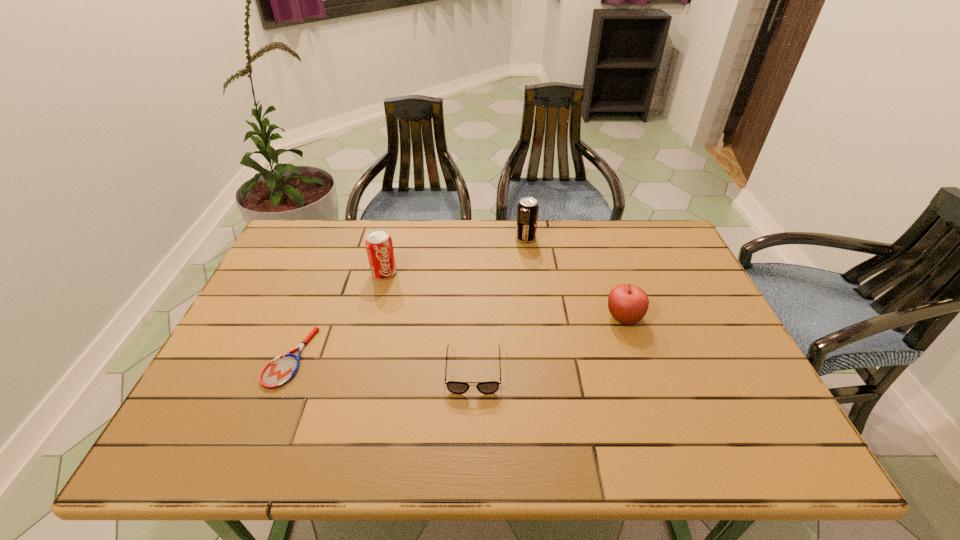
Image resolution: width=960 pixels, height=540 pixels. I want to click on unoccupied position between the third tallest object and the second object from right to left, so point(574,278).

Find the location of `vacant space that's between the farther soda can and the second farthest object`. vacant space that's between the farther soda can and the second farthest object is located at coordinates (455, 255).

Locate an element on the screen. The image size is (960, 540). vacant space in between the leftmost object and the nearer soda can is located at coordinates (337, 315).

What are the coordinates of `vacant area that lies between the third tallest object and the second object from left to right` in the screenshot? It's located at (504, 295).

In order to click on object that stands as the fourth closest to the leftmost object in this screenshot , I will do `click(628, 304)`.

The image size is (960, 540). What are the coordinates of `object that is the third closest to the right soda can` in the screenshot? It's located at (454, 387).

Identify the location of free region that satisfies the following two spatial constraints: 1. on the front side of the right soda can; 2. on the left side of the third tallest object. The width and height of the screenshot is (960, 540). (536, 318).

Where is `free point that satisfies the following two spatial constraints: 1. on the front side of the farthest object; 2. on the right side of the rightmost object`? free point that satisfies the following two spatial constraints: 1. on the front side of the farthest object; 2. on the right side of the rightmost object is located at coordinates (536, 318).

Locate an element on the screen. The width and height of the screenshot is (960, 540). free space that satisfies the following two spatial constraints: 1. on the back side of the farthest object; 2. on the left side of the left soda can is located at coordinates (393, 238).